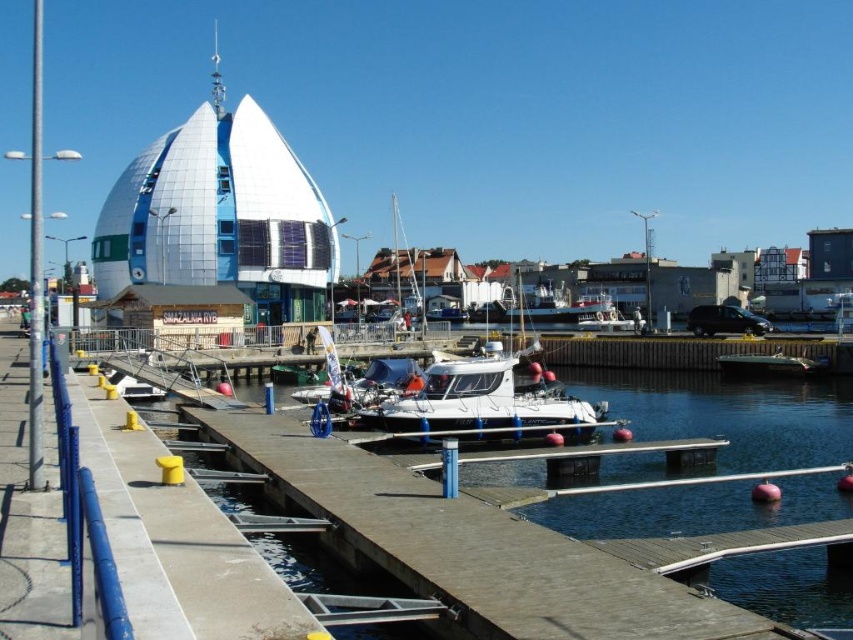
Can you confirm if white glossy boat at lower right is bigger than white glossy boat at center?

No, white glossy boat at lower right is not bigger than white glossy boat at center.

Does white glossy boat at lower right appear on the right side of white glossy boat at center?

Yes, white glossy boat at lower right is to the right of white glossy boat at center.

Find the location of a particular element. white glossy boat at lower right is located at coordinates (770, 364).

The width and height of the screenshot is (853, 640). Identify the location of white glossy boat at lower right. (770, 364).

Is white matte boat at center to the left of white glossy boat at center from the viewer's perspective?

Indeed, white matte boat at center is positioned on the left side of white glossy boat at center.

Is white matte boat at center above white glossy boat at center?

Incorrect, white matte boat at center is not positioned above white glossy boat at center.

Who is more forward, (421, 436) or (581, 316)?

Positioned in front is point (421, 436).

Locate an element on the screen. The image size is (853, 640). white matte boat at center is located at coordinates (480, 404).

In the scene shown: Is white matte boat at center thinner than white glossy boat at lower right?

No.

Is point (492, 364) closer to viewer compared to point (761, 369)?

Yes, it is in front of point (761, 369).

What are the coordinates of `white matte boat at center` in the screenshot? It's located at (480, 404).